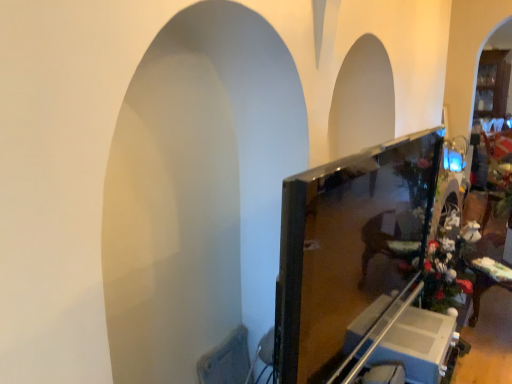
Question: Can you confirm if metallic silver swivel chair at lower right, the 1th swivel chair viewed from the right, is smaller than white glossy cabinet at lower right?

Choices:
 (A) yes
 (B) no

Answer: (A)

Question: Considering the relative sizes of metallic silver swivel chair at lower right, which appears as the 2th swivel chair when viewed from the left, and white glossy cabinet at lower right in the image provided, is metallic silver swivel chair at lower right, which appears as the 2th swivel chair when viewed from the left, thinner than white glossy cabinet at lower right?

Choices:
 (A) no
 (B) yes

Answer: (B)

Question: Is metallic silver swivel chair at lower right, which appears as the 2th swivel chair when viewed from the left, behind white glossy cabinet at lower right?

Choices:
 (A) no
 (B) yes

Answer: (A)

Question: Is metallic silver swivel chair at lower right, which appears as the 2th swivel chair when viewed from the left, far away from white glossy cabinet at lower right?

Choices:
 (A) no
 (B) yes

Answer: (A)

Question: Could you tell me if metallic silver swivel chair at lower right, which appears as the 2th swivel chair when viewed from the left, is facing white glossy cabinet at lower right?

Choices:
 (A) no
 (B) yes

Answer: (A)

Question: Does metallic silver swivel chair at lower right, which appears as the 2th swivel chair when viewed from the left, have a lesser height compared to white glossy cabinet at lower right?

Choices:
 (A) yes
 (B) no

Answer: (B)

Question: Is white glossy cabinet at lower right taller than textured fabric swivel chair at lower left, the 1th swivel chair positioned from the left?

Choices:
 (A) yes
 (B) no

Answer: (B)

Question: Considering the relative positions of white glossy cabinet at lower right and textured fabric swivel chair at lower left, the 1th swivel chair positioned from the left, in the image provided, is white glossy cabinet at lower right behind textured fabric swivel chair at lower left, the 1th swivel chair positioned from the left,?

Choices:
 (A) yes
 (B) no

Answer: (A)

Question: From the image's perspective, would you say white glossy cabinet at lower right is positioned over textured fabric swivel chair at lower left, positioned as the second swivel chair in right-to-left order?

Choices:
 (A) yes
 (B) no

Answer: (A)

Question: Does white glossy cabinet at lower right appear on the right side of textured fabric swivel chair at lower left, positioned as the second swivel chair in right-to-left order?

Choices:
 (A) no
 (B) yes

Answer: (B)

Question: Is white glossy cabinet at lower right wider than textured fabric swivel chair at lower left, positioned as the second swivel chair in right-to-left order?

Choices:
 (A) yes
 (B) no

Answer: (A)

Question: Does white glossy cabinet at lower right have a larger size compared to textured fabric swivel chair at lower left, the 1th swivel chair positioned from the left?

Choices:
 (A) no
 (B) yes

Answer: (B)

Question: Considering the relative sizes of metallic silver swivel chair at lower right, the 1th swivel chair viewed from the right, and matte black monitor at center in the image provided, is metallic silver swivel chair at lower right, the 1th swivel chair viewed from the right, smaller than matte black monitor at center?

Choices:
 (A) yes
 (B) no

Answer: (A)